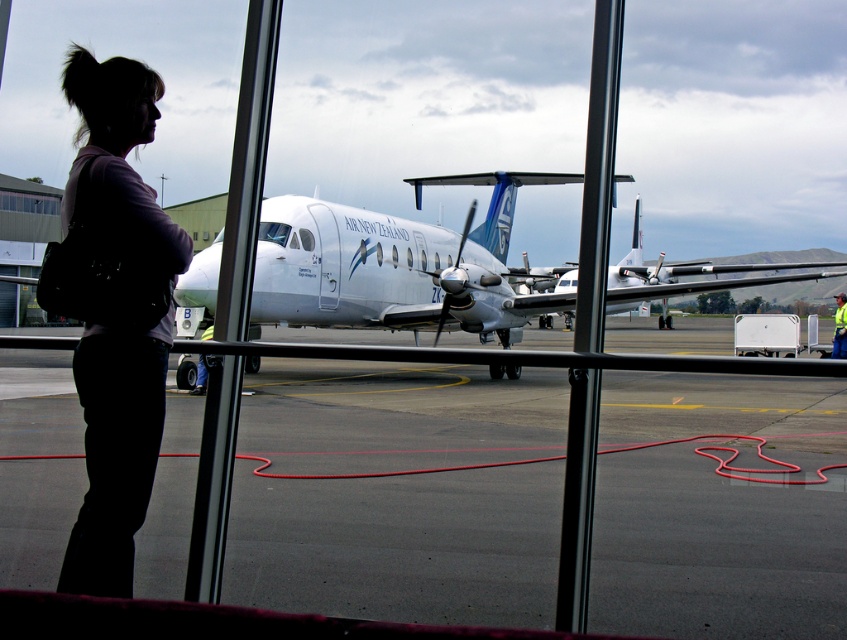
Is black asphalt tarmac at center below white glossy airplane at center?

Correct, black asphalt tarmac at center is located below white glossy airplane at center.

Is black asphalt tarmac at center in front of white glossy airplane at center?

No, black asphalt tarmac at center is behind white glossy airplane at center.

Who is more distant from viewer, (341, 529) or (446, 310)?

Point (446, 310)

What are the coordinates of `black asphalt tarmac at center` in the screenshot? It's located at 399,545.

Which is behind, point (270, 422) or point (89, 154)?

The point (270, 422) is behind.

You are a GUI agent. You are given a task and a screenshot of the screen. Output one action in this format:
    pyautogui.click(x=<x>, y=<y>)
    Task: Click on the black asphalt tarmac at center
    
    Given the screenshot: What is the action you would take?
    pyautogui.click(x=399, y=545)

Who is higher up, white glossy airplane at center or yellow reflective vest at lower right?

Positioned higher is white glossy airplane at center.

Between white glossy airplane at center and yellow reflective vest at lower right, which one is positioned lower?

Positioned lower is yellow reflective vest at lower right.

This screenshot has width=847, height=640. Identify the location of white glossy airplane at center. (388, 269).